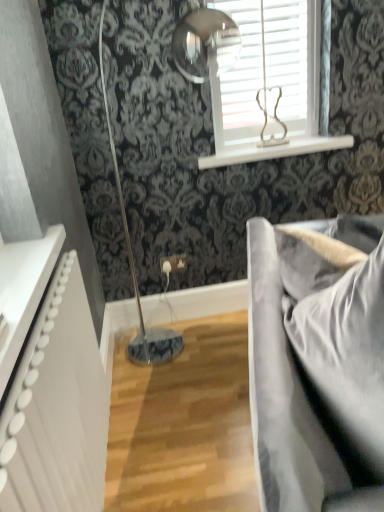
Find the location of `free location above white glossy window sill at upper center (from a real-world perspective)`. free location above white glossy window sill at upper center (from a real-world perspective) is located at coordinates (269, 145).